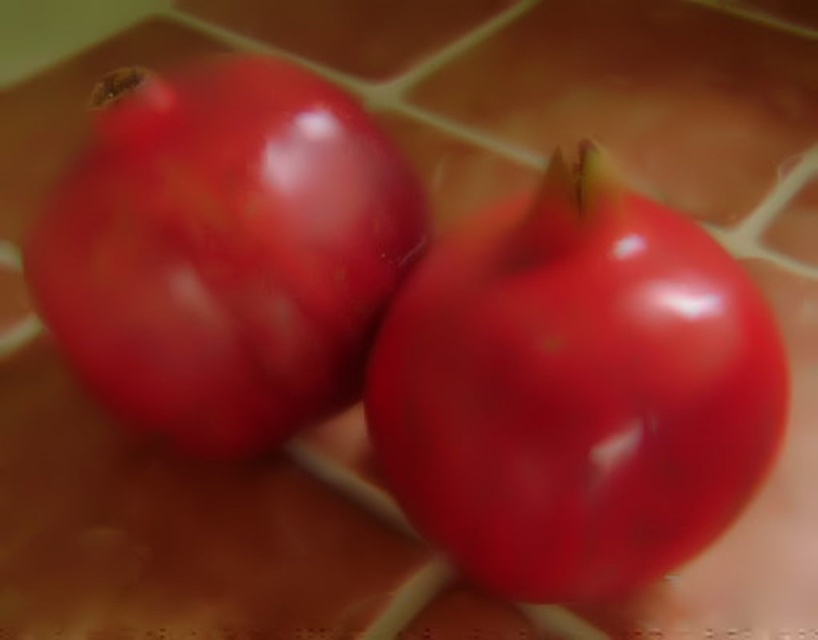
In the scene shown: Can you confirm if glossy red tomato at center is positioned to the right of glossy red tomato at left?

Indeed, glossy red tomato at center is positioned on the right side of glossy red tomato at left.

Is glossy red tomato at center thinner than glossy red tomato at left?

Correct, glossy red tomato at center's width is less than glossy red tomato at left's.

The width and height of the screenshot is (818, 640). Identify the location of glossy red tomato at center. (576, 390).